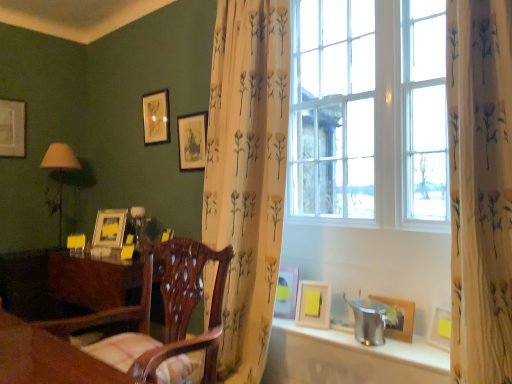
Find the location of a particular element. This screenshot has width=512, height=384. space that is in front of matte white picture frame at upper right, arranged as the second picture frame when viewed from the right is located at coordinates (320, 332).